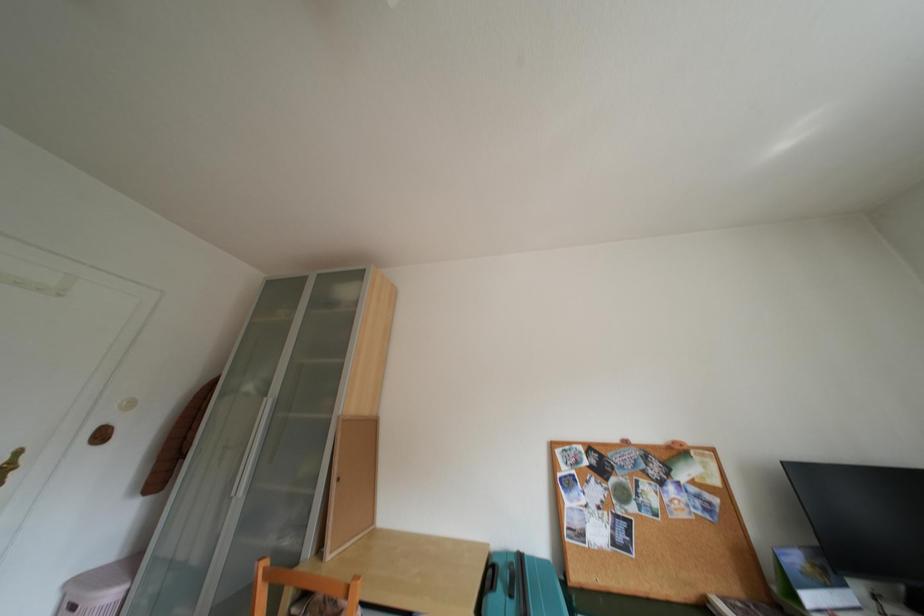
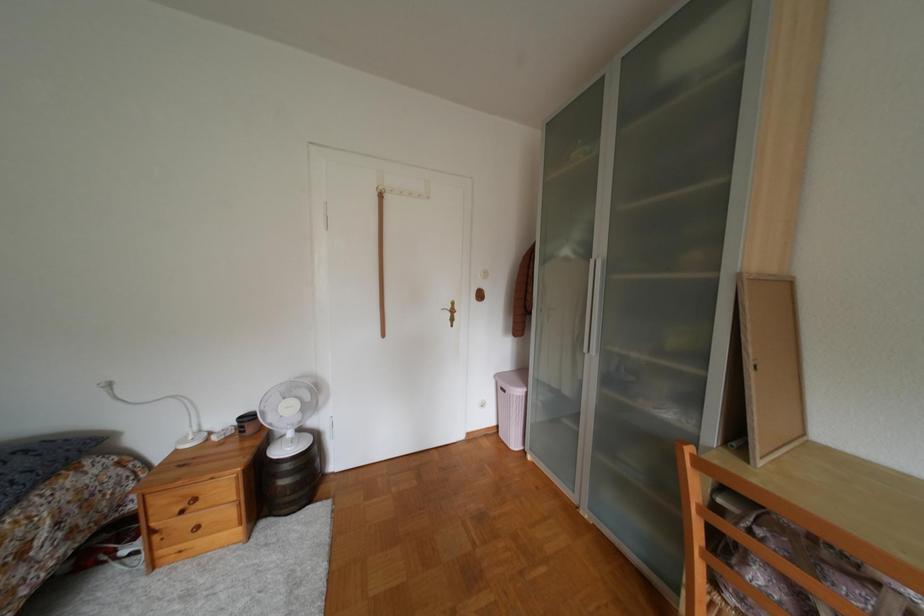
From the picture: Based on the continuous images, in which direction is the camera rotating?

The camera rotated toward left-down.